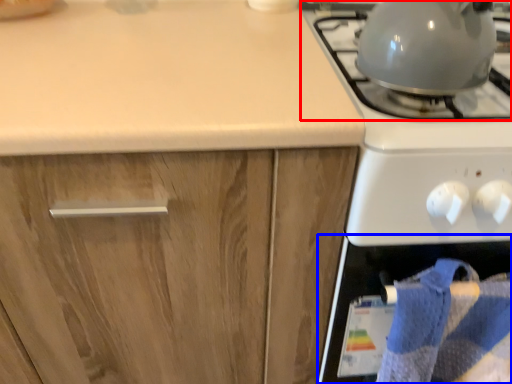
Question: Which object is further to the camera taking this photo, gas stove (highlighted by a red box) or oven (highlighted by a blue box)?

Choices:
 (A) gas stove
 (B) oven

Answer: (B)